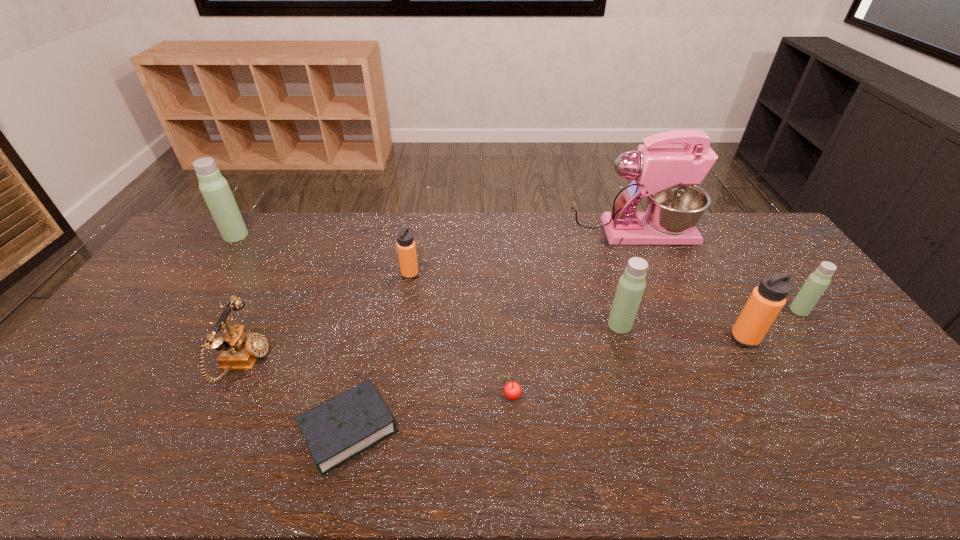
Find the location of a particular element. The image size is (960, 540). the second farthest thermos bottle is located at coordinates (406, 248).

What are the coordinates of `telephone` in the screenshot? It's located at (240, 350).

Identify the location of the fifth object from left to right. This screenshot has width=960, height=540. (512, 390).

Where is `cherry`? This screenshot has width=960, height=540. cherry is located at coordinates (512, 390).

Where is `black Bible`? black Bible is located at coordinates (341, 428).

At what (x,y) coordinates should I click in order to perform the action: click on Bible. Please return your answer as a coordinate pair (x, y). Looking at the image, I should click on (341, 428).

I want to click on free space located on the face of the mixer, so click(x=740, y=233).

The width and height of the screenshot is (960, 540). I want to click on free space located 0.210m on the right of the leftmost object, so click(304, 235).

Locate an element on the screen. vacant space situated on the right of the bigger orange thermos bottle is located at coordinates (852, 338).

Identify the location of free space located 0.250m on the front of the third thermos bottle from right to left. The width and height of the screenshot is (960, 540). (646, 410).